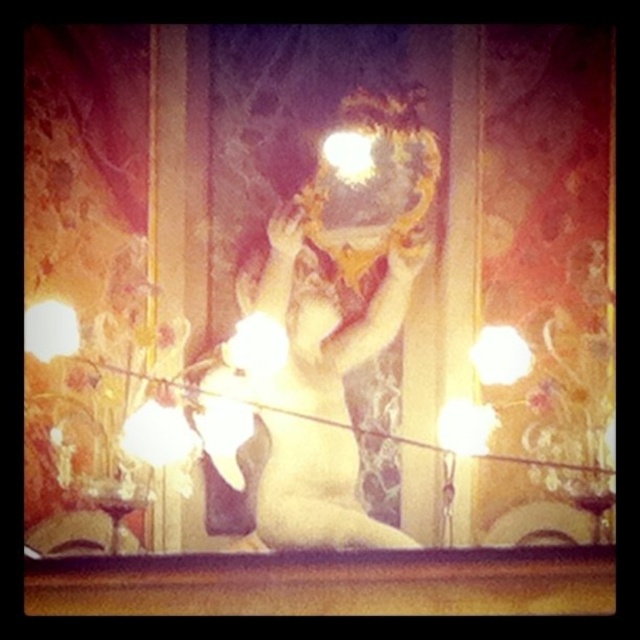
Can you confirm if smooth gold statue at center is taller than white satin dress at center?

Yes, smooth gold statue at center is taller than white satin dress at center.

Is smooth gold statue at center to the left of white satin dress at center from the viewer's perspective?

Incorrect, smooth gold statue at center is not on the left side of white satin dress at center.

What are the coordinates of `smooth gold statue at center` in the screenshot? It's located at (317, 392).